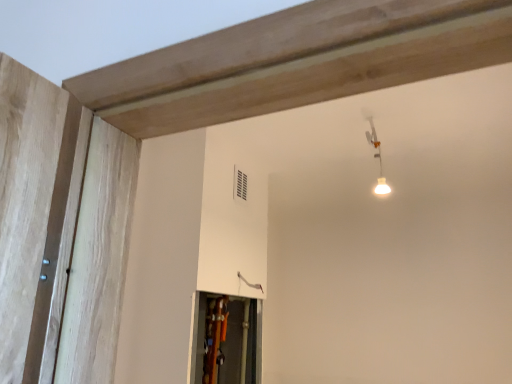
Locate an element on the screen. This screenshot has width=512, height=384. wooden brown garage door at lower center is located at coordinates (227, 340).

Describe the element at coordinates (227, 340) in the screenshot. I see `wooden brown garage door at lower center` at that location.

The image size is (512, 384). What are the coordinates of `wooden brown garage door at lower center` in the screenshot? It's located at pyautogui.click(x=227, y=340).